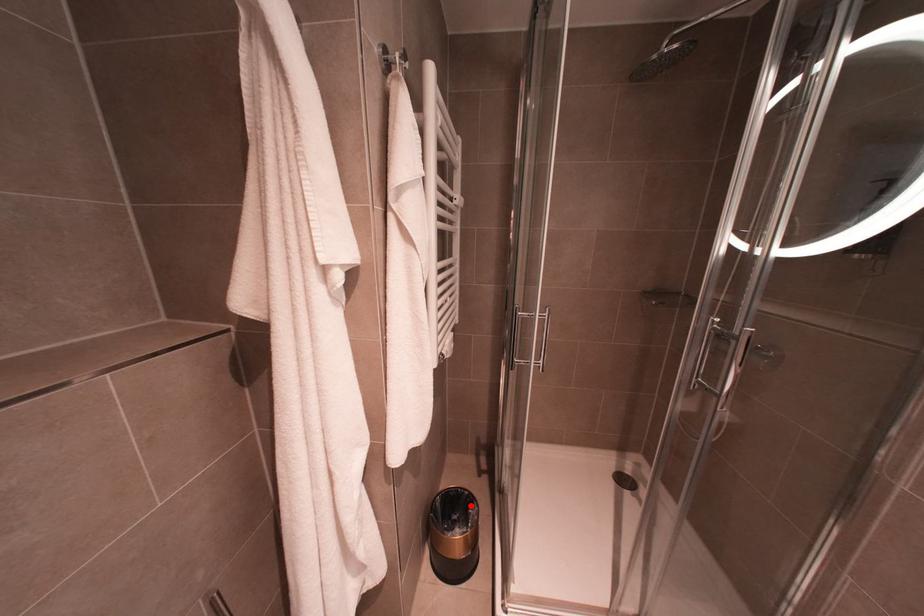
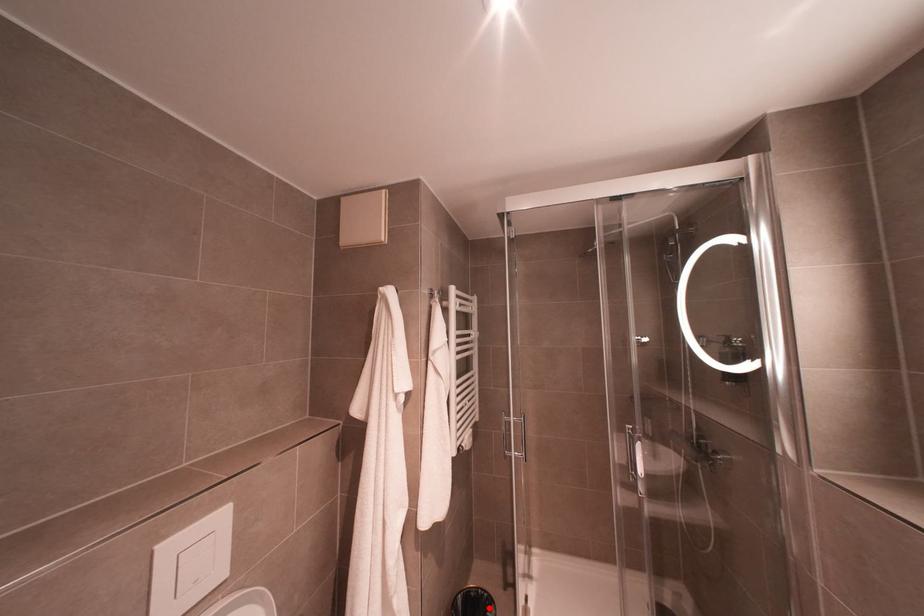
I am providing you with two images of the same scene from different viewpoints. A red point is marked on the first image and another point is marked on the second image. Is the marked point in image1 the same physical position as the marked point in image2?

Yes